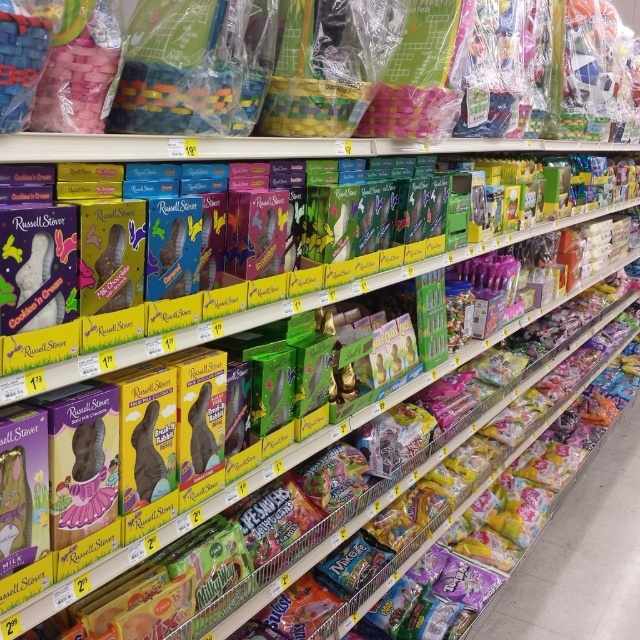
You are a store employee organizing the Easter display. You need to place a new batch of items on the shelf. The translucent plastic bags at lower right and the matte plastic easter basket at upper center are already present. Which object has a greater width, requiring more horizontal space?

The translucent plastic bags at lower right have a greater width than the matte plastic easter basket at upper center, so they require more horizontal space.

You are a customer in the grocery store looking for an Easter basket. You see the translucent plastic bags at lower right and the matte plastic easter basket at upper center. Which one is located to the right side of the other?

The translucent plastic bags at lower right is to the right of the matte plastic easter basket at upper center.